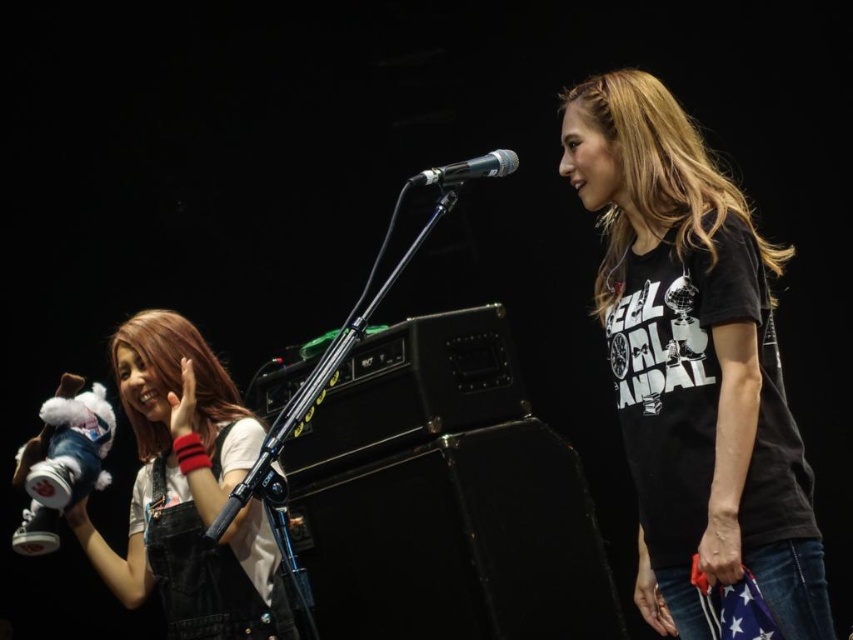
Question: Is white plush toy at left below metallic silver microphone at center?

Choices:
 (A) no
 (B) yes

Answer: (B)

Question: Which object is positioned closest to the white plush toy at left?

Choices:
 (A) black cotton t-shirt at center
 (B) metallic silver microphone at center

Answer: (B)

Question: Based on their relative distances, which object is nearer to the metallic silver microphone at center?

Choices:
 (A) black cotton t-shirt at center
 (B) white plush toy at left

Answer: (A)

Question: Observing the image, what is the correct spatial positioning of black cotton t-shirt at center in reference to white plush toy at left?

Choices:
 (A) below
 (B) above

Answer: (B)

Question: Which object is closer to the camera taking this photo?

Choices:
 (A) black cotton t-shirt at center
 (B) metallic silver microphone at center
 (C) white plush toy at left

Answer: (A)

Question: In this image, where is black cotton t-shirt at center located relative to metallic silver microphone at center?

Choices:
 (A) above
 (B) below

Answer: (B)